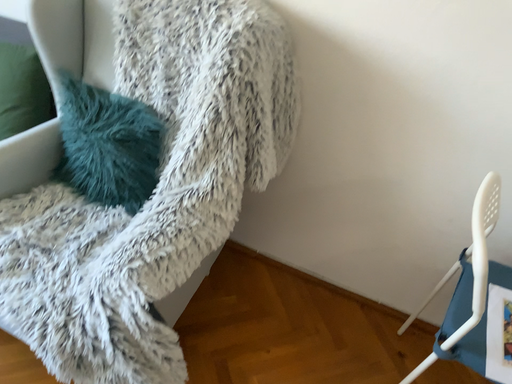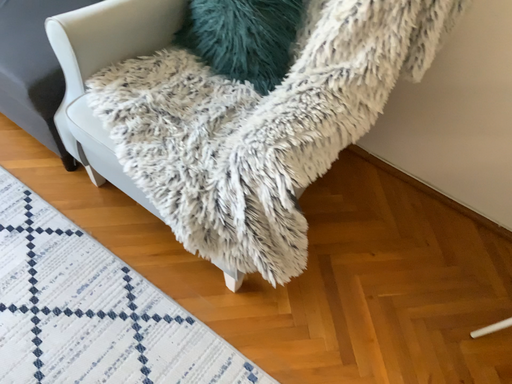
Question: How did the camera likely rotate when shooting the video?

Choices:
 (A) rotated right
 (B) rotated left

Answer: (B)